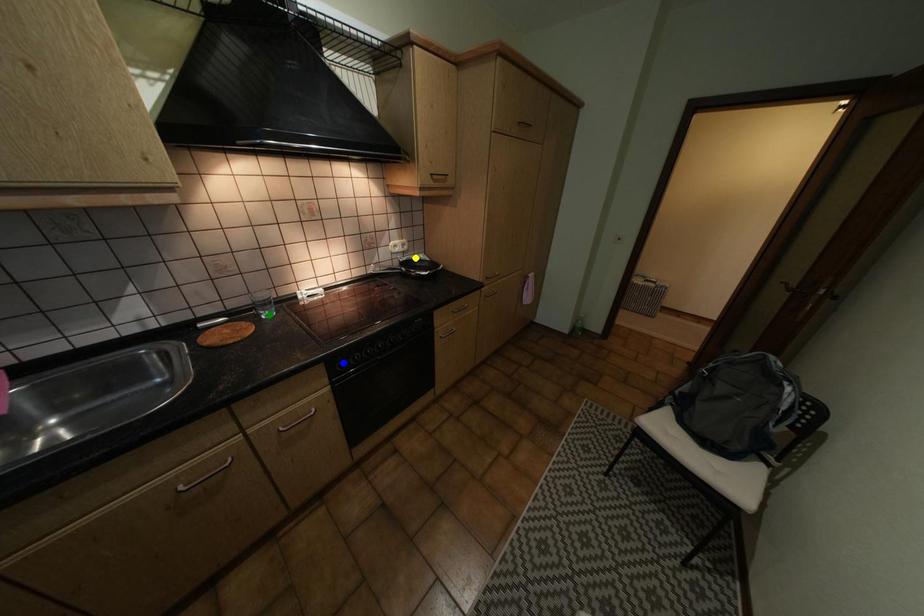
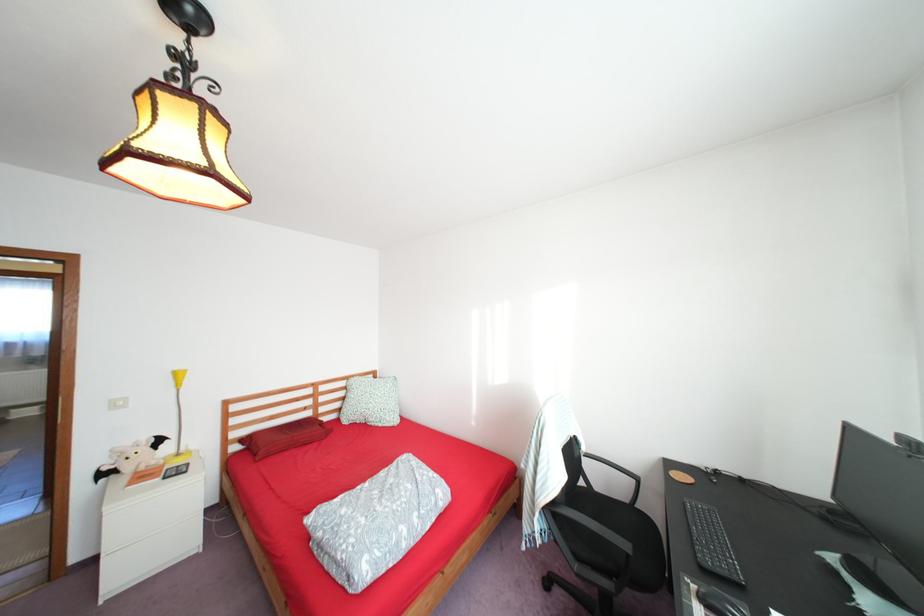
I am providing you with two images of the same scene from different viewpoints. Three points are marked in image1. Which point corresponds to a part or object that is occluded in image2?In image1, three points are marked. Which of them correspond to a part or object that is occluded in image2?Among the three points shown in image1, which one corresponds to a part or object that is no longer visible due to occlusion in image2?

Invisible in image2: yellow point, blue point, green point.